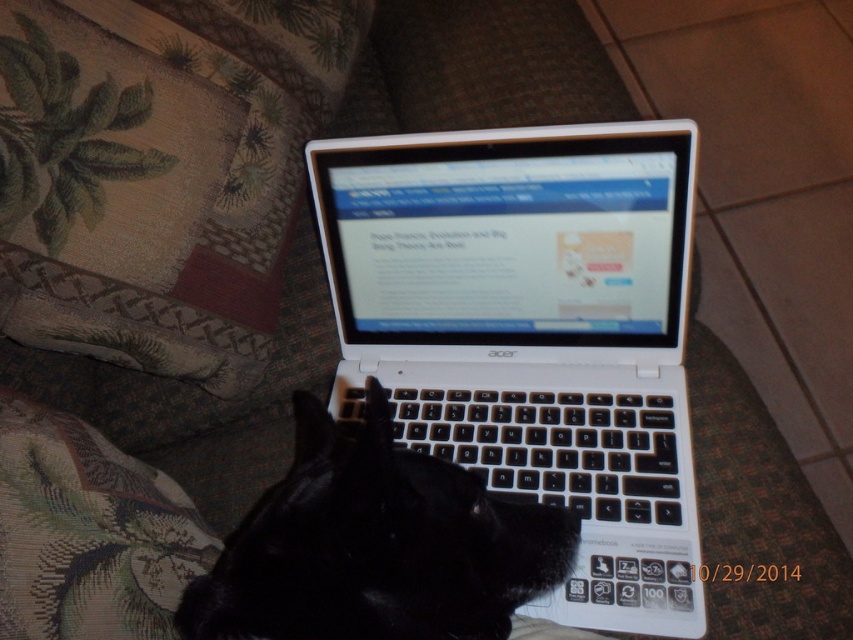
Question: Is white plastic laptop at center wider than black fur cat at center?

Choices:
 (A) no
 (B) yes

Answer: (B)

Question: Is white plastic laptop at center above black fur cat at center?

Choices:
 (A) no
 (B) yes

Answer: (B)

Question: Does white plastic laptop at center have a larger size compared to black fur cat at center?

Choices:
 (A) yes
 (B) no

Answer: (A)

Question: Which point is farther to the camera?

Choices:
 (A) (482, 566)
 (B) (672, 230)

Answer: (B)

Question: Which of the following is the closest to the observer?

Choices:
 (A) white plastic laptop at center
 (B) black fur cat at center

Answer: (B)